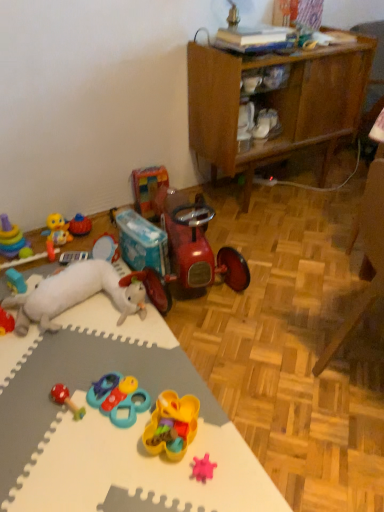
Where is `empty space that is in between translucent yellow plastic toy at center, marked as the 11th toy in a left-to-right arrangement, and rubber teething ring at lower left, the 3th toy in the left-to-right sequence`? The width and height of the screenshot is (384, 512). empty space that is in between translucent yellow plastic toy at center, marked as the 11th toy in a left-to-right arrangement, and rubber teething ring at lower left, the 3th toy in the left-to-right sequence is located at coordinates (100, 352).